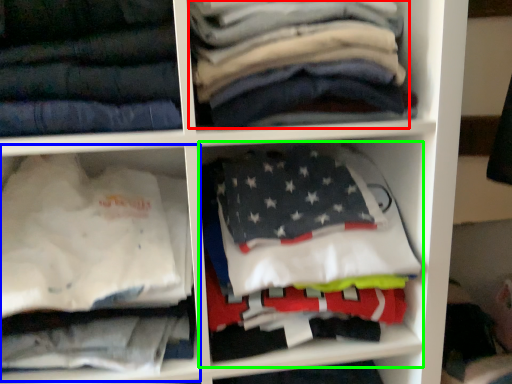
Question: Which is nearer to the clothing (highlighted by a red box)? cabinet (highlighted by a blue box) or cabinet (highlighted by a green box).

Choices:
 (A) cabinet
 (B) cabinet

Answer: (B)